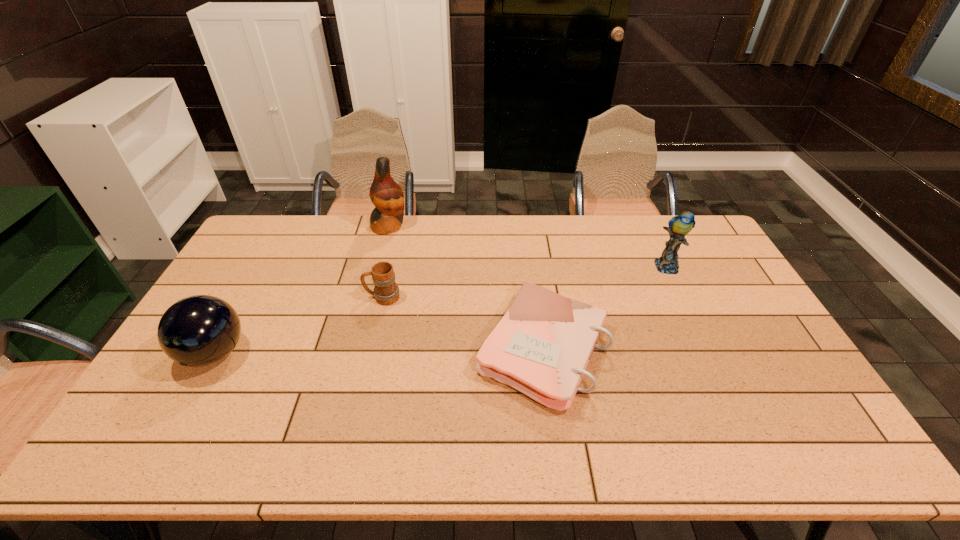
What are the coordinates of `the tallest object` in the screenshot? It's located at (386, 195).

You are a GUI agent. You are given a task and a screenshot of the screen. Output one action in this format:
    pyautogui.click(x=<x>, y=<y>)
    Task: Click on the farther parrot
    
    Given the screenshot: What is the action you would take?
    click(x=386, y=195)

Locate an element on the screen. The height and width of the screenshot is (540, 960). the right parrot is located at coordinates (679, 226).

Locate an element on the screen. The image size is (960, 540). the fourth nearest object is located at coordinates (679, 226).

Where is `the leftmost object`? the leftmost object is located at coordinates (200, 330).

Where is `bowling ball`? Image resolution: width=960 pixels, height=540 pixels. bowling ball is located at coordinates (200, 330).

The height and width of the screenshot is (540, 960). I want to click on mug, so click(386, 291).

At what (x,y) coordinates should I click in order to perform the action: click on phonebook. Please return your answer as a coordinate pair (x, y). The width and height of the screenshot is (960, 540). Looking at the image, I should click on (541, 347).

The width and height of the screenshot is (960, 540). In order to click on the shortest object in this screenshot , I will do `click(541, 347)`.

In order to click on vacant area situated on the face of the tallest object in this screenshot , I will do `click(480, 226)`.